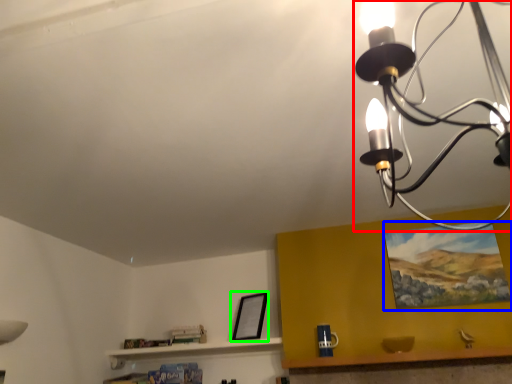
Question: Estimate the real-world distances between objects in this image. Which object is closer to lamp (highlighted by a red box), picture frame (highlighted by a blue box) or picture frame (highlighted by a green box)?

Choices:
 (A) picture frame
 (B) picture frame

Answer: (A)